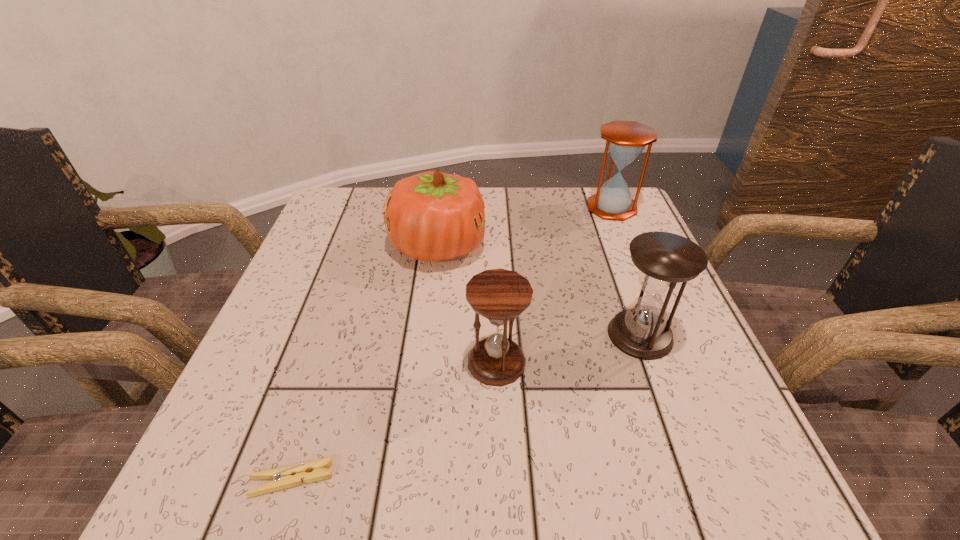
I want to click on the third closest object to the leftmost hourglass, so click(289, 476).

Identify which hourglass is the nearest to the leftmost hourglass. Please provide its 2D coordinates. Your answer should be formatted as a tuple, i.e. [(x, y)], where the tuple contains the x and y coordinates of a point satisfying the conditions above.

[(665, 261)]

Choose which hourglass is the second nearest neighbor to the leftmost hourglass. Please provide its 2D coordinates. Your answer should be formatted as a tuple, i.e. [(x, y)], where the tuple contains the x and y coordinates of a point satisfying the conditions above.

[(625, 140)]

Locate an element on the screen. This screenshot has width=960, height=540. free space that satisfies the following two spatial constraints: 1. on the front side of the farthest hourglass; 2. on the side of the pumpkin with the cute face is located at coordinates (628, 246).

Identify the location of vacant position in the image that satisfies the following two spatial constraints: 1. on the side of the pumpkin with the cute face; 2. on the right side of the leftmost hourglass. Image resolution: width=960 pixels, height=540 pixels. (423, 362).

This screenshot has width=960, height=540. Identify the location of blank space that satisfies the following two spatial constraints: 1. on the side of the leftmost hourglass with the cute face; 2. on the left side of the pumpkin. [x=423, y=362].